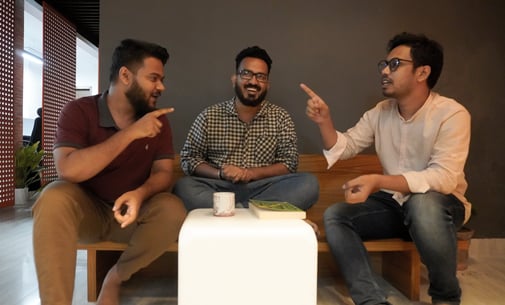
This screenshot has width=505, height=305. Find the location of `mug`. mug is located at coordinates (221, 199).